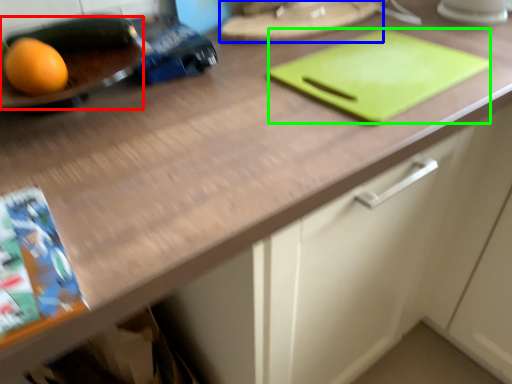
Question: Estimate the real-world distances between objects in this image. Which object is farther from tray (highlighted by a red box), tray (highlighted by a blue box) or tray (highlighted by a green box)?

Choices:
 (A) tray
 (B) tray

Answer: (B)